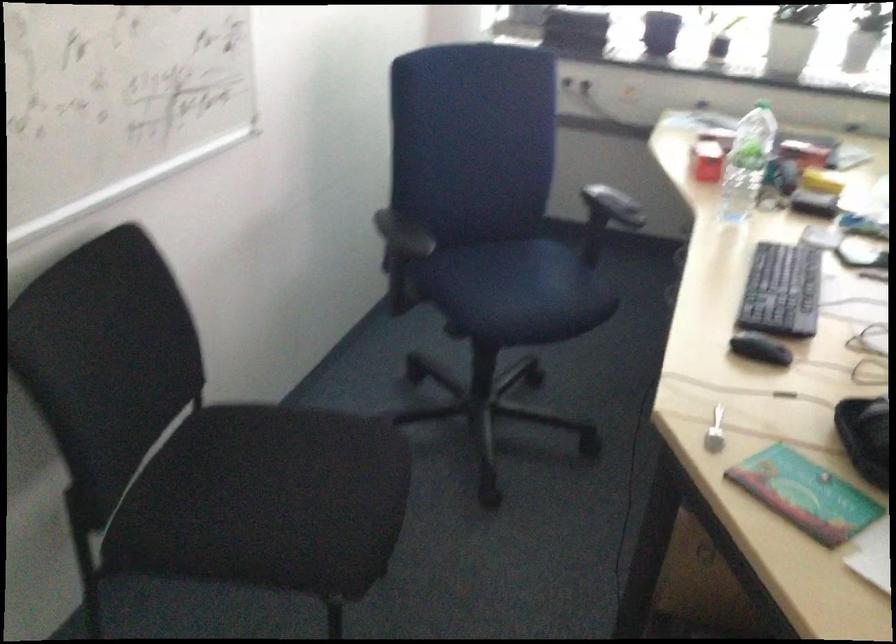
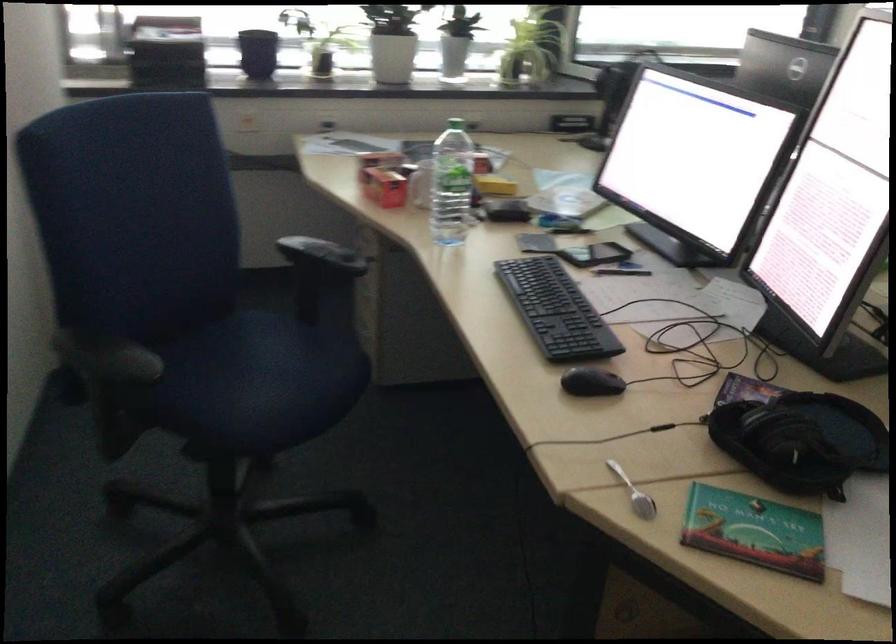
Locate, in the second image, the point that corresponds to [760,350] in the first image.

(590, 382)